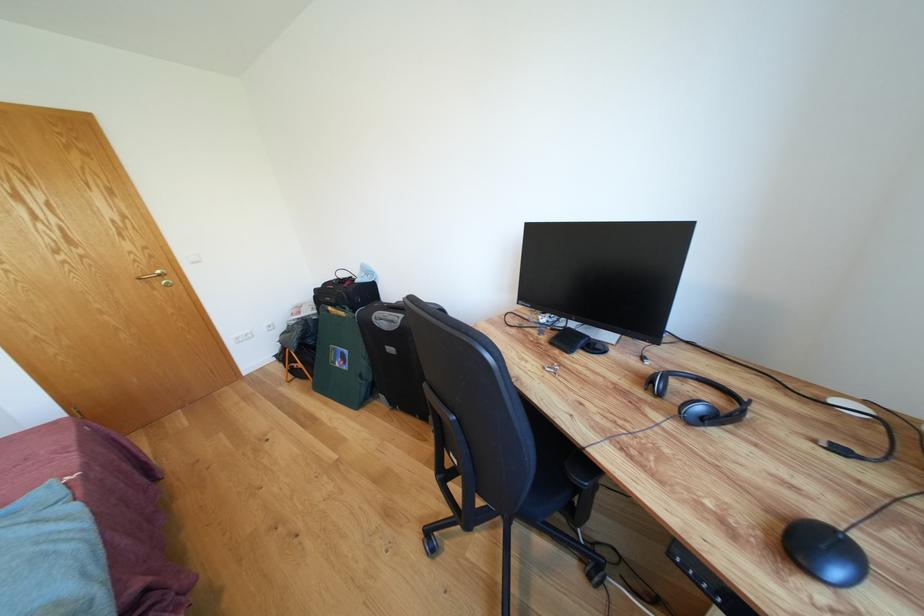
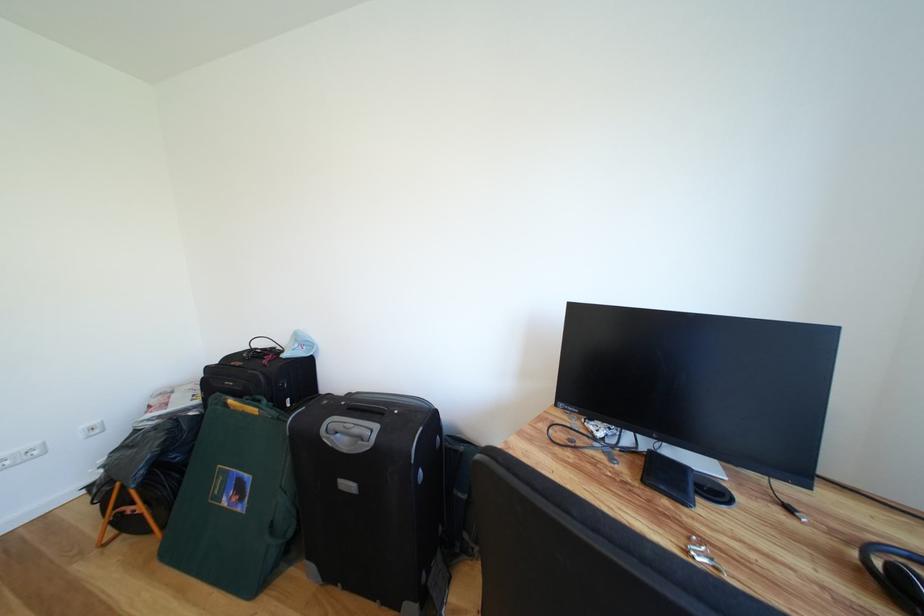
Locate, in the second image, the point that corresponds to point 562,369 in the first image.

(698, 543)